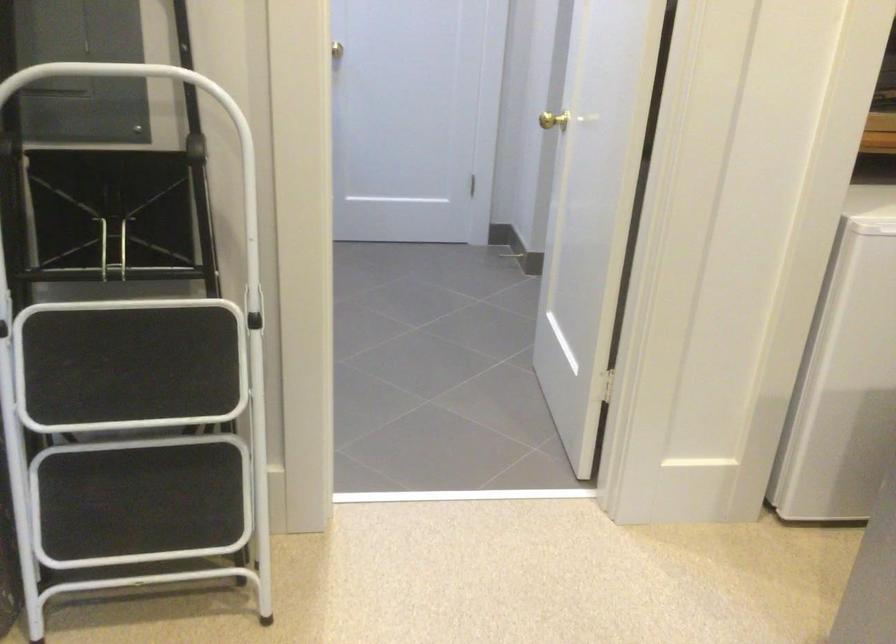
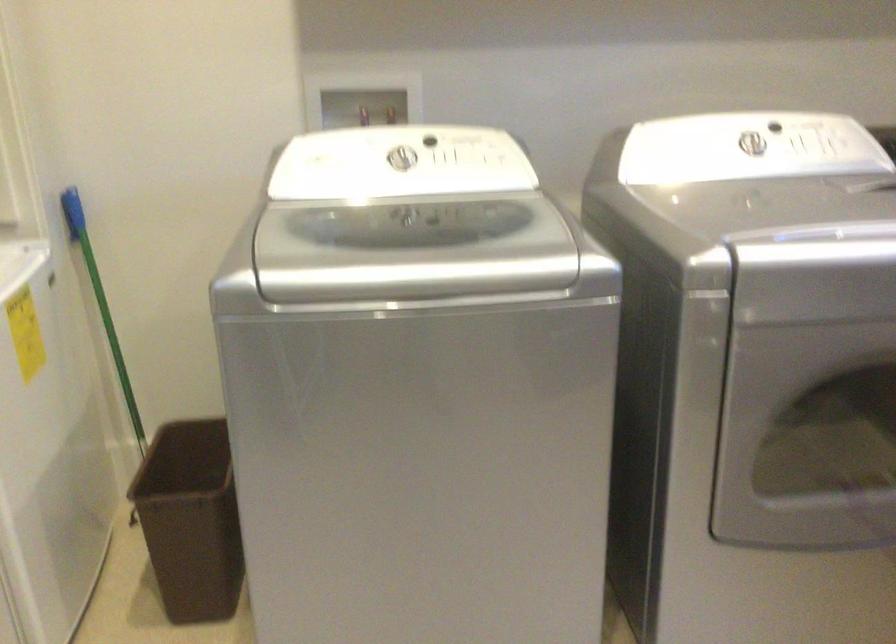
The first image is from the beginning of the video and the second image is from the end. How did the camera likely rotate when shooting the video?

The rotation direction of the camera is right-down.